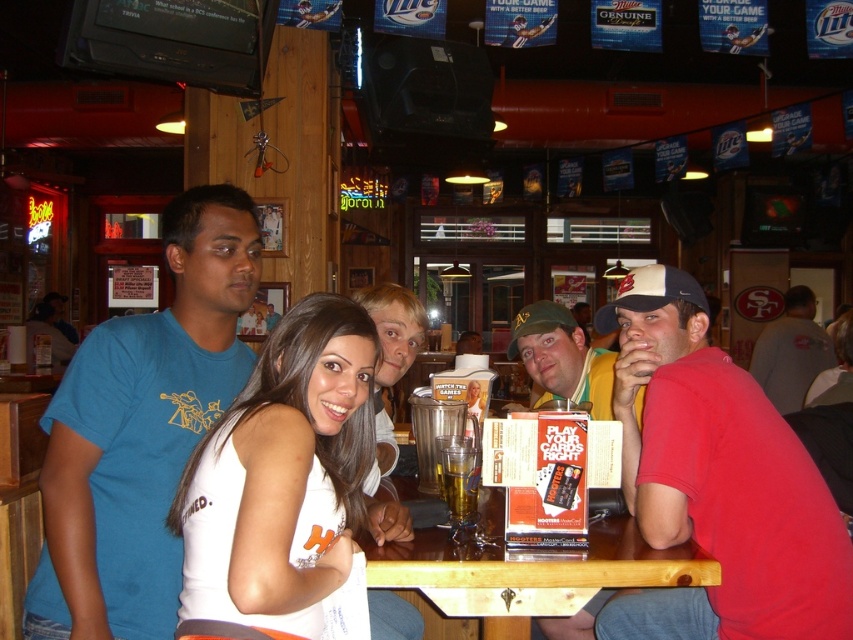
Question: Which of the following is the farthest from the observer?

Choices:
 (A) (227, 548)
 (B) (241, 376)
 (C) (463, 548)

Answer: (B)

Question: Is wooden at center above translucent plastic cup at table center?

Choices:
 (A) yes
 (B) no

Answer: (B)

Question: Does wooden at center appear on the left side of smooth white shirt at center?

Choices:
 (A) yes
 (B) no

Answer: (B)

Question: Which object is positioned farthest from the red cotton shirt at center?

Choices:
 (A) white fabric baseball cap at upper right
 (B) wooden at center
 (C) gray fabric shirt at right

Answer: (C)

Question: Does translucent plastic cup at table center appear under green fabric baseball cap at center?

Choices:
 (A) no
 (B) yes

Answer: (B)

Question: Which object is closer to the camera taking this photo?

Choices:
 (A) white matte tank top at center
 (B) green fabric cap at center

Answer: (A)